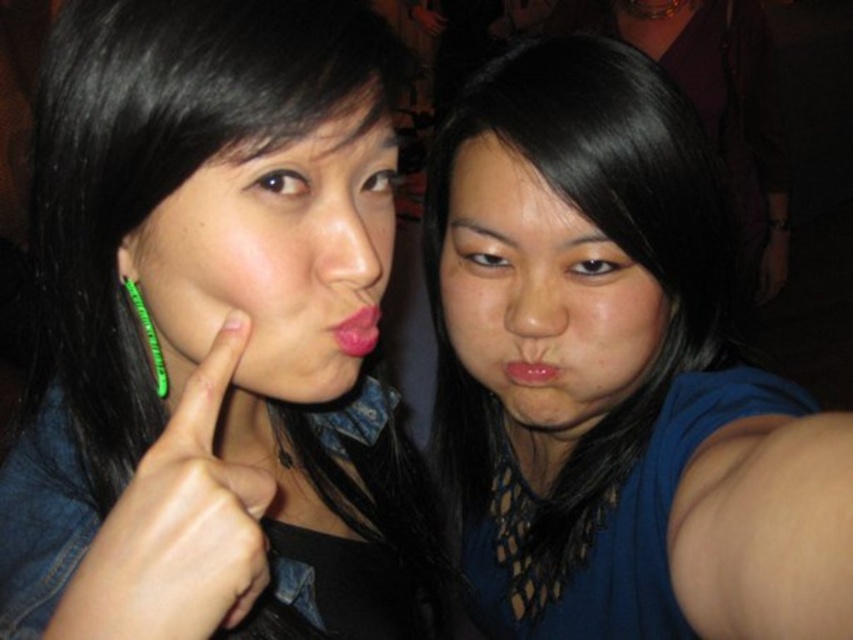
You are taking a selfie with two friends. You notice the matte black hair at left and the matte pink lips at center in the frame. Which object is positioned to the right side of the other?

The matte pink lips at center are positioned to the right of the matte black hair at left.

You are a photographer trying to adjust the lighting for a photo shoot. You have a spotlight that can only illuminate a circular area with a radius of 0.3 units. The center of the spotlight is at point 0.5, 0.5. Will the blue fabric shirt at center be fully illuminated by the spotlight?

The blue fabric shirt at center is located at point (614, 371). The distance between the spotlight center at (426, 320) and the shirt is sqrt. Since the radius of the spotlight is 0.3 units, the shirt is outside the illuminated area and will not be fully illuminated.